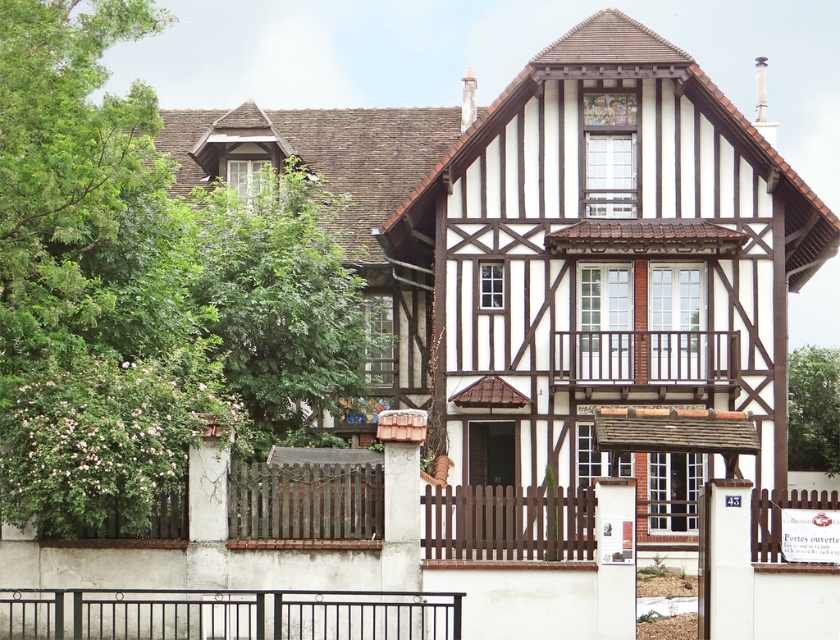
This screenshot has height=640, width=840. Describe the element at coordinates (282, 305) in the screenshot. I see `green leafy tree at upper left` at that location.

Does point (273, 369) lie in front of point (814, 410)?

Yes, point (273, 369) is in front of point (814, 410).

Find the location of a particular element. The width and height of the screenshot is (840, 640). green leafy tree at upper left is located at coordinates 282,305.

This screenshot has width=840, height=640. Find the location of `green leafy tree at upper left`. green leafy tree at upper left is located at coordinates (282, 305).

Which is in front, point (240, 220) or point (420, 620)?

Positioned in front is point (420, 620).

Is green leafy tree at upper left wider than black metal fence at lower center?

No.

Who is more forward, (231, 211) or (145, 636)?

Point (145, 636)

I want to click on green leafy tree at upper left, so click(x=282, y=305).

Is the position of black metal fence at lower center more distant than that of green leafy tree at right?

No, it is in front of green leafy tree at right.

I want to click on black metal fence at lower center, so click(226, 614).

Locate an element on the screen. This screenshot has width=840, height=640. black metal fence at lower center is located at coordinates (226, 614).